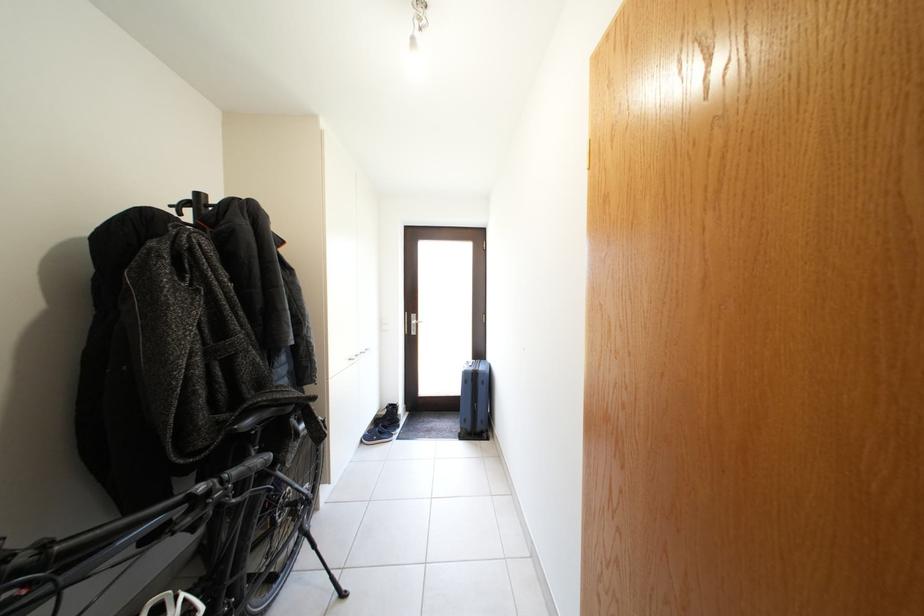
Find the location of `black bicycle seat`. black bicycle seat is located at coordinates (257, 418).